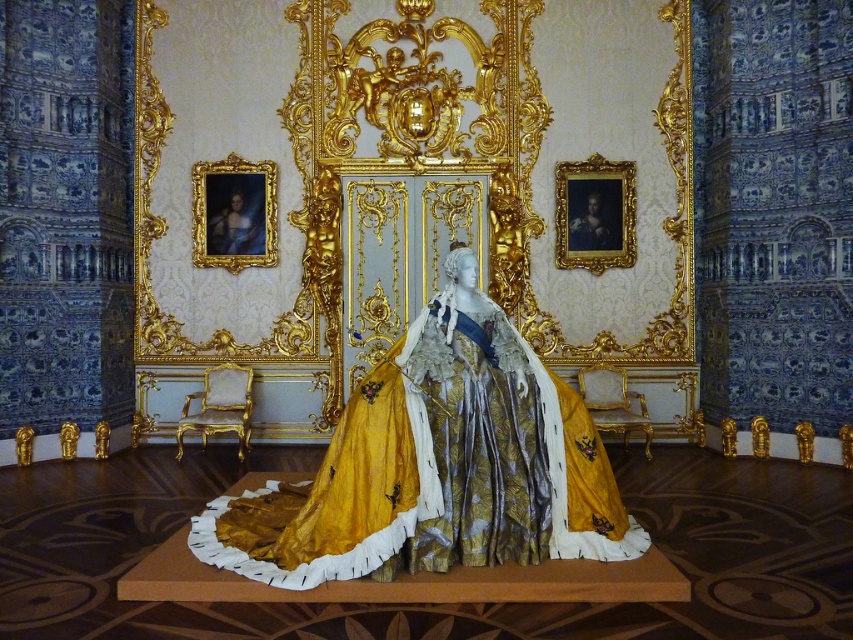
Between gold ornate frame at upper left and gold ornate frame at upper right, which one appears on the right side from the viewer's perspective?

gold ornate frame at upper right is more to the right.

This screenshot has height=640, width=853. What do you see at coordinates (234, 212) in the screenshot? I see `gold ornate frame at upper left` at bounding box center [234, 212].

Image resolution: width=853 pixels, height=640 pixels. Describe the element at coordinates (234, 212) in the screenshot. I see `gold ornate frame at upper left` at that location.

Locate an element on the screen. The width and height of the screenshot is (853, 640). gold ornate frame at upper left is located at coordinates (234, 212).

Does gold satin gown at center appear under gold ornate frame at upper right?

Yes.

Who is more distant from viewer, (432,332) or (598,195)?

Point (598,195)

Who is more distant from viewer, (363, 406) or (569, 180)?

The point (569, 180) is more distant.

Find the location of `gold satin gown at center`. gold satin gown at center is located at coordinates (440, 467).

Between gold satin gown at center and gold ornate frame at upper left, which one is positioned higher?

gold ornate frame at upper left is above.

Which of these two, gold satin gown at center or gold ornate frame at upper left, stands shorter?

gold ornate frame at upper left is shorter.

This screenshot has height=640, width=853. In order to click on gold satin gown at center in this screenshot , I will do `click(440, 467)`.

Find the location of `gold satin gown at center`. gold satin gown at center is located at coordinates (440, 467).